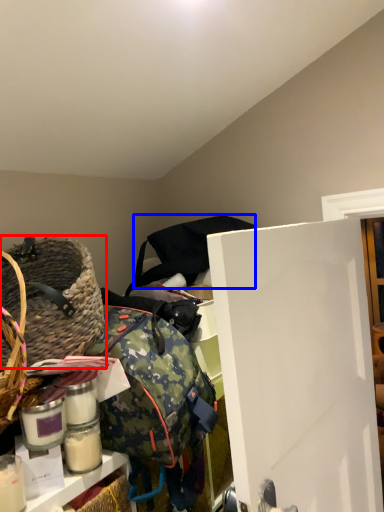
Question: Which of the following is the closest to the observer, picnic basket (highlighted by a red box) or bag (highlighted by a blue box)?

Choices:
 (A) picnic basket
 (B) bag

Answer: (A)